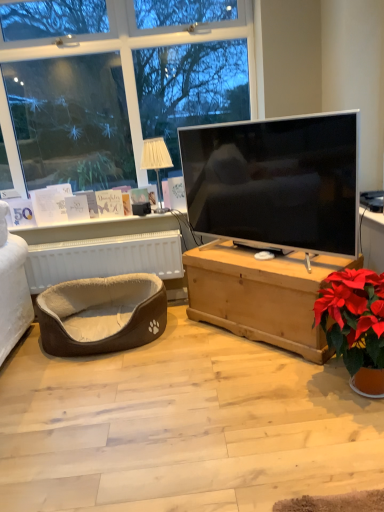
I want to click on vacant area that is situated to the right of brown plush pet bed at lower left, so click(199, 344).